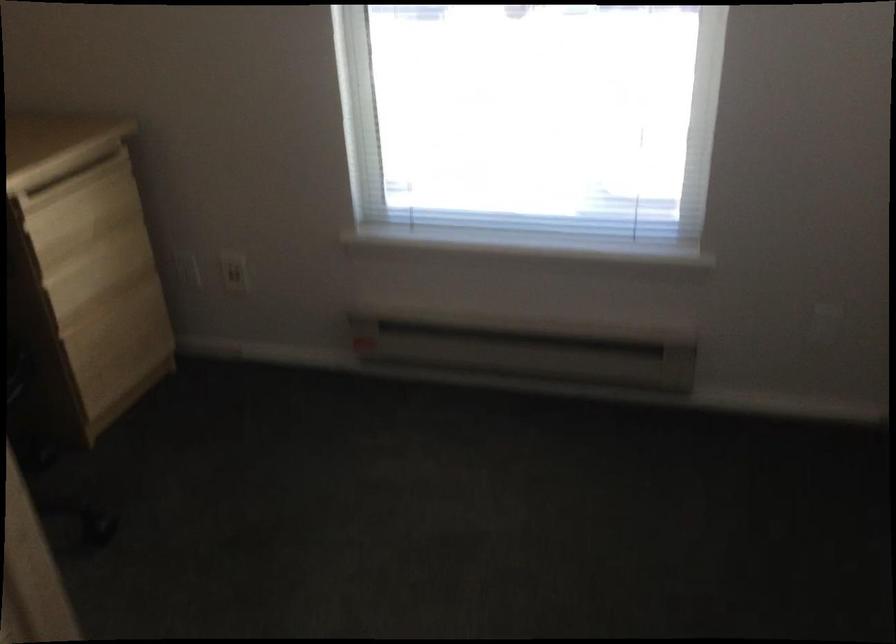
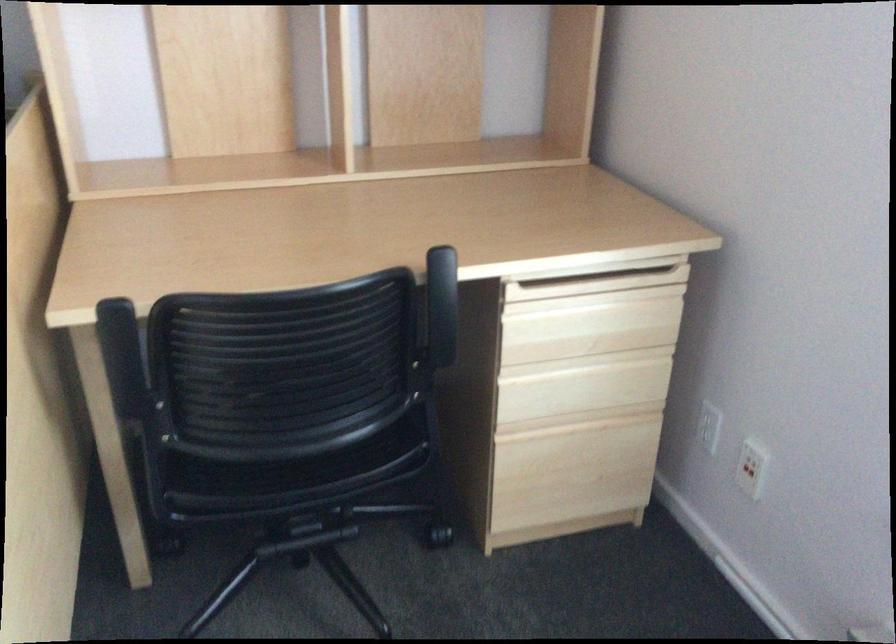
In the second image, find the point that corresponds to (x=237, y=276) in the first image.

(747, 471)